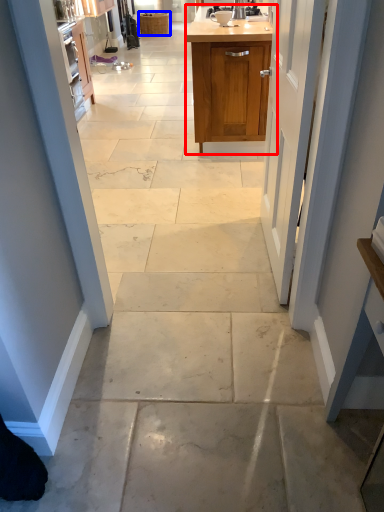
Question: Which of the following is the farthest to the observer, cabinetry (highlighted by a red box) or cabinetry (highlighted by a blue box)?

Choices:
 (A) cabinetry
 (B) cabinetry

Answer: (B)